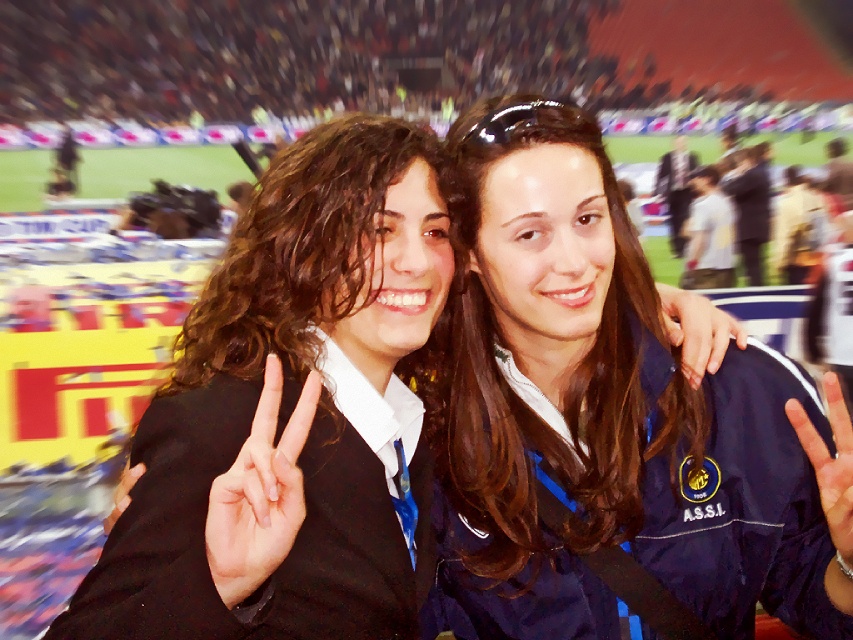
Looking at this image, please describe the exact location of the white matte hand at center in the image using coordinates.

The white matte hand at center is located at coordinates point (259, 492).